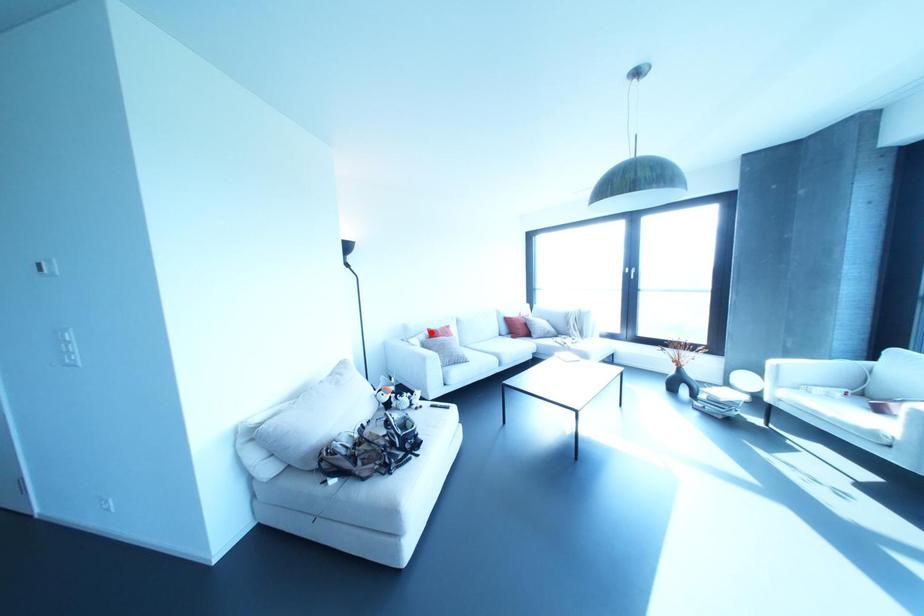
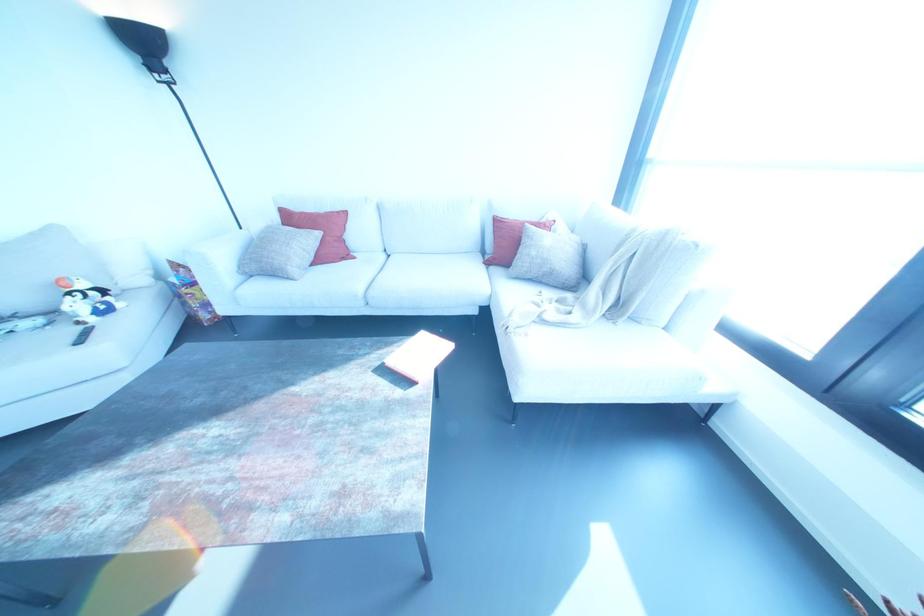
The point at the highlighted location is marked in the first image. Where is the corresponding point in the second image?

(286, 217)